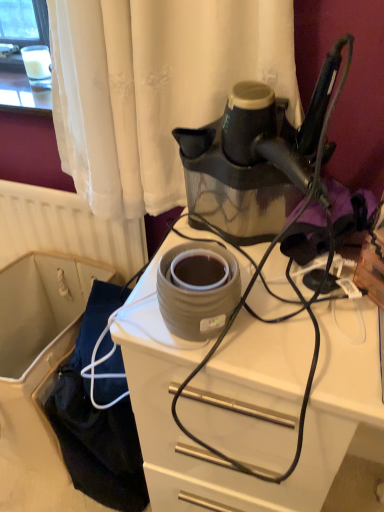
Identify the location of vacant point above matte gray ceramic at center (from a real-world perspective). (317, 296).